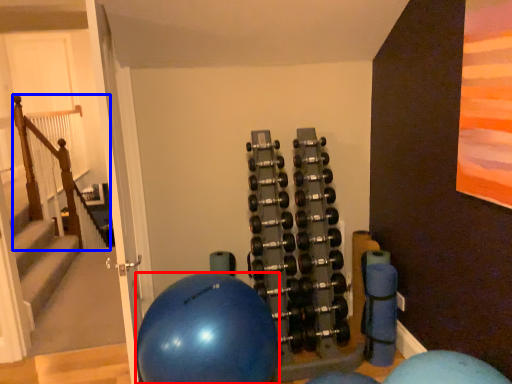
Question: Among these objects, which one is farthest to the camera, ball (highlighted by a red box) or rail (highlighted by a blue box)?

Choices:
 (A) ball
 (B) rail

Answer: (B)